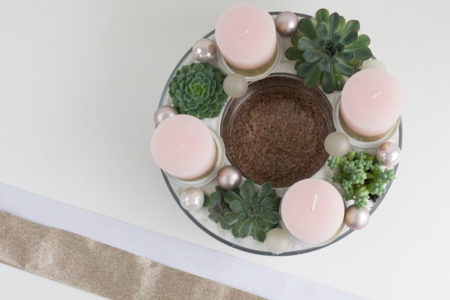
Find the location of `plant`. plant is located at coordinates click(246, 213), click(195, 83), click(332, 53), click(362, 179).